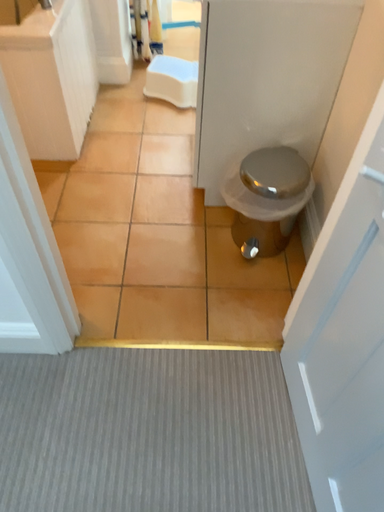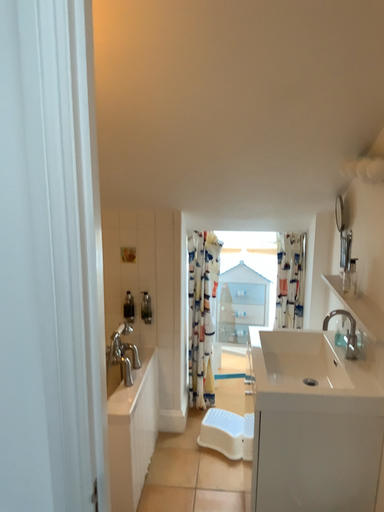
Question: How did the camera likely rotate when shooting the video?

Choices:
 (A) rotated downward
 (B) rotated upward

Answer: (B)